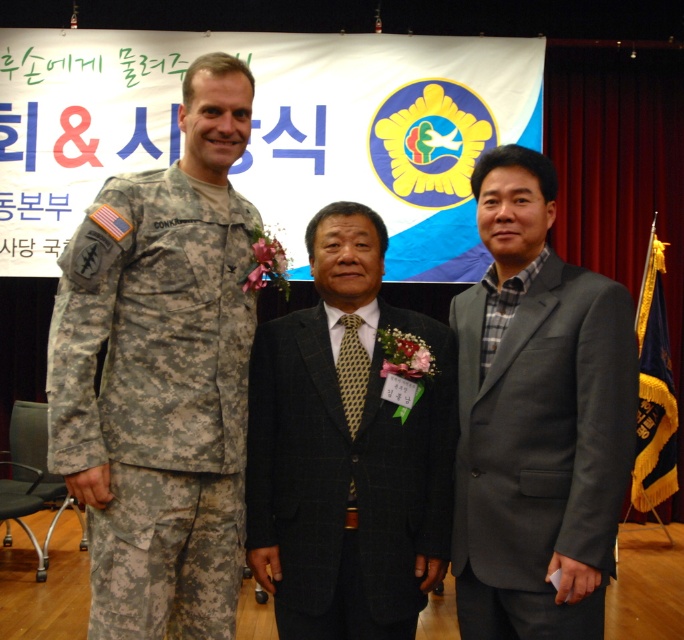
Question: Is camouflage uniform at left bigger than gray wool suit at center?

Choices:
 (A) yes
 (B) no

Answer: (A)

Question: Which object is the farthest from the camouflage uniform at left?

Choices:
 (A) blue velvet flag at right
 (B) dark gray textured suit at center
 (C) gray wool suit at center

Answer: (A)

Question: Which object is closer to the camera taking this photo?

Choices:
 (A) blue velvet flag at right
 (B) camouflage uniform at left
 (C) dark gray textured suit at center

Answer: (B)

Question: Observing the image, what is the correct spatial positioning of gray wool suit at center in reference to blue velvet flag at right?

Choices:
 (A) above
 (B) below

Answer: (A)

Question: Based on their relative distances, which object is nearer to the gray wool suit at center?

Choices:
 (A) blue velvet flag at right
 (B) camouflage uniform at left

Answer: (B)

Question: Does camouflage uniform at left appear over dark gray textured suit at center?

Choices:
 (A) no
 (B) yes

Answer: (B)